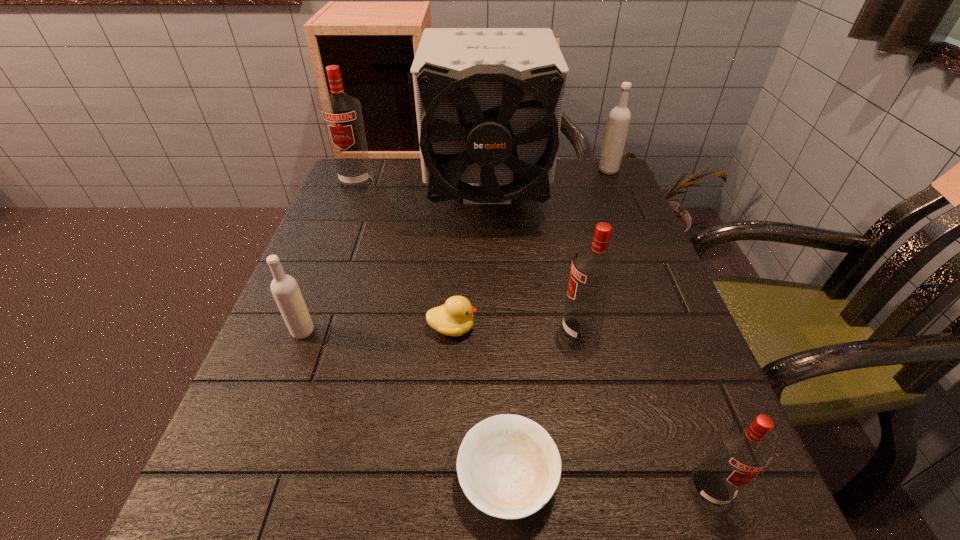
The width and height of the screenshot is (960, 540). In order to click on object that is at the near right corner in this screenshot , I will do `click(741, 451)`.

The height and width of the screenshot is (540, 960). In the image, there is a desktop. In order to click on vacant space at the near edge in this screenshot , I will do `click(421, 522)`.

Find the location of a particular element. This screenshot has height=540, width=960. vacant area at the left edge of the desktop is located at coordinates (361, 276).

You are a GUI agent. You are given a task and a screenshot of the screen. Output one action in this format:
    pyautogui.click(x=<x>, y=<y>)
    Task: Click on the blank space at the right edge
    This screenshot has height=540, width=960.
    Given the screenshot: What is the action you would take?
    pyautogui.click(x=651, y=476)

In the image, there is a desktop. Identify the location of free region at the far left corner. This screenshot has height=540, width=960. (383, 180).

In the image, there is a desktop. Identify the location of free region at the near left corner. The image size is (960, 540). (181, 536).

Identify the location of vacant area between the smallest red vodka and the biggest red vodka. The image size is (960, 540). (533, 336).

Where is `vacant region between the smaller white vodka and the right white vodka`? Image resolution: width=960 pixels, height=540 pixels. vacant region between the smaller white vodka and the right white vodka is located at coordinates (455, 251).

At what (x,y) coordinates should I click in order to perform the action: click on free space between the gray fan and the second shortest object. Please return your answer as a coordinate pair (x, y). This screenshot has width=960, height=540. Looking at the image, I should click on (469, 263).

You are a GUI agent. You are given a task and a screenshot of the screen. Output one action in this format:
    pyautogui.click(x=<x>, y=<y>)
    Task: Click on the empty location between the smaller white vodka and the tallest object
    The height and width of the screenshot is (540, 960).
    Given the screenshot: What is the action you would take?
    pyautogui.click(x=395, y=265)